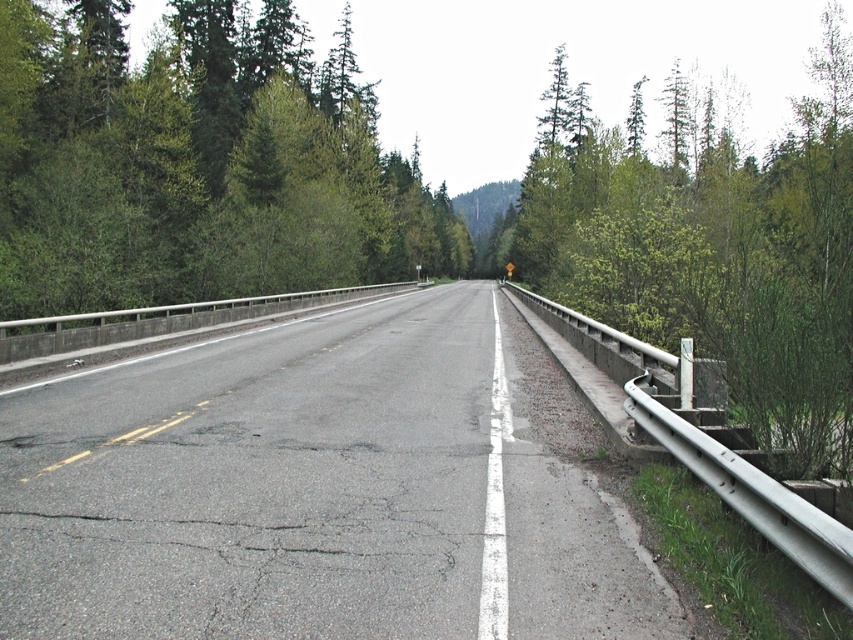
Is asphalt road at center smaller than green leafy trees at center?

Yes.

Is asphalt road at center below green leafy trees at center?

Yes.

Between point (534, 536) and point (422, 250), which one is positioned behind?

Positioned behind is point (422, 250).

At what (x,y) coordinates should I click in order to perform the action: click on asphalt road at center. Please return your answer as a coordinate pair (x, y). The image size is (853, 640). Looking at the image, I should click on (311, 492).

Is green leafy trees at center taller than green leafy shrub at right?

In fact, green leafy trees at center may be shorter than green leafy shrub at right.

Is green leafy trees at center shorter than green leafy shrub at right?

Yes, green leafy trees at center is shorter than green leafy shrub at right.

Does point (107, 179) come farther from viewer compared to point (769, 177)?

No, (107, 179) is in front of (769, 177).

Where is `green leafy trees at center`? This screenshot has width=853, height=640. green leafy trees at center is located at coordinates [x=196, y=163].

Between point (277, 324) and point (822, 451), which one is positioned in front?

Point (822, 451) is in front.

Which is in front, point (149, 400) or point (706, 122)?

Point (149, 400) is more forward.

Where is `asphalt road at center`? The image size is (853, 640). asphalt road at center is located at coordinates click(x=311, y=492).